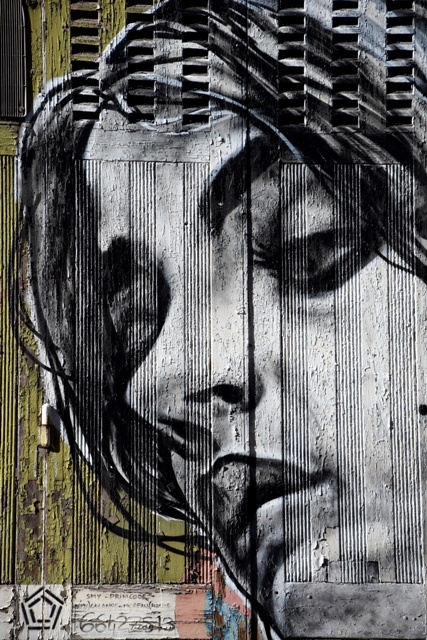
Where is `green window shutter`? The height and width of the screenshot is (640, 427). green window shutter is located at coordinates (37, 45).